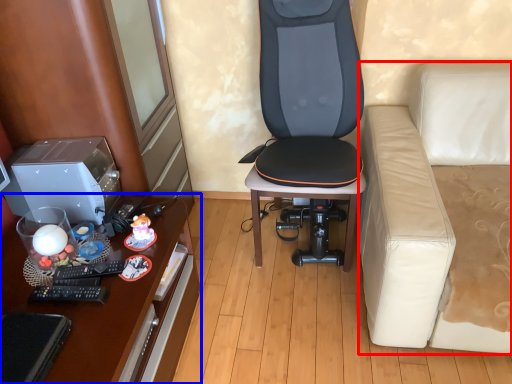
Question: Which point is further to the camera, studio couch (highlighted by a red box) or desk (highlighted by a blue box)?

Choices:
 (A) studio couch
 (B) desk

Answer: (B)